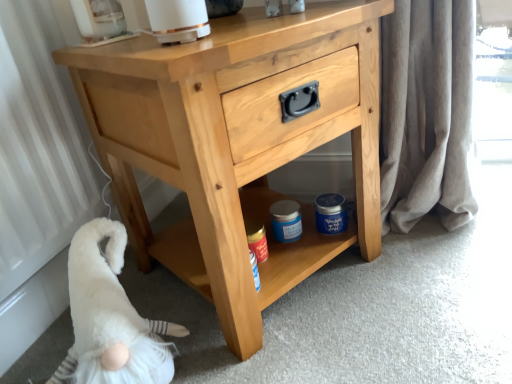
Question: Does light wood chest of drawers at center have a greater width compared to white fluffy gnome at lower left?

Choices:
 (A) no
 (B) yes

Answer: (B)

Question: From the image's perspective, is light wood chest of drawers at center on white fluffy gnome at lower left?

Choices:
 (A) yes
 (B) no

Answer: (A)

Question: Is light wood chest of drawers at center facing away from white fluffy gnome at lower left?

Choices:
 (A) no
 (B) yes

Answer: (A)

Question: From a real-world perspective, is light wood chest of drawers at center physically above white fluffy gnome at lower left?

Choices:
 (A) yes
 (B) no

Answer: (A)

Question: Considering the relative sizes of light wood chest of drawers at center and white fluffy gnome at lower left in the image provided, is light wood chest of drawers at center smaller than white fluffy gnome at lower left?

Choices:
 (A) no
 (B) yes

Answer: (A)

Question: Could you tell me if light wood chest of drawers at center is turned towards white fluffy gnome at lower left?

Choices:
 (A) yes
 (B) no

Answer: (B)

Question: Does white fluffy gnome at lower left have a greater width compared to light wood chest of drawers at center?

Choices:
 (A) yes
 (B) no

Answer: (B)

Question: Is white fluffy gnome at lower left to the left of light wood chest of drawers at center from the viewer's perspective?

Choices:
 (A) yes
 (B) no

Answer: (A)

Question: From the image's perspective, is white fluffy gnome at lower left beneath light wood chest of drawers at center?

Choices:
 (A) yes
 (B) no

Answer: (A)

Question: Can you confirm if white fluffy gnome at lower left is thinner than light wood chest of drawers at center?

Choices:
 (A) yes
 (B) no

Answer: (A)

Question: Is white fluffy gnome at lower left located outside light wood chest of drawers at center?

Choices:
 (A) no
 (B) yes

Answer: (B)

Question: Are white fluffy gnome at lower left and light wood chest of drawers at center beside each other?

Choices:
 (A) no
 (B) yes

Answer: (A)

Question: From a real-world perspective, is white fluffy gnome at lower left above or below light wood chest of drawers at center?

Choices:
 (A) above
 (B) below

Answer: (B)